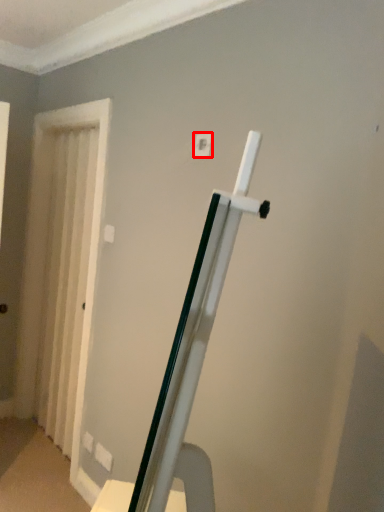
Question: From the image's perspective, what is the correct spatial positioning of light switch (annotated by the red box) in reference to curtain?

Choices:
 (A) above
 (B) below

Answer: (A)